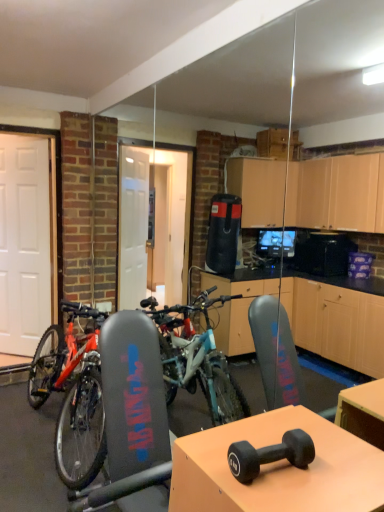
Question: In the image, is black rubber dumbbell at center on the left side or the right side of teal matte bicycle at center?

Choices:
 (A) left
 (B) right

Answer: (B)

Question: From a real-world perspective, is black rubber dumbbell at center physically located above or below teal matte bicycle at center?

Choices:
 (A) below
 (B) above

Answer: (B)

Question: Estimate the real-world distances between objects in this image. Which object is closer to the black rubber dumbbell at center?

Choices:
 (A) teal matte bicycle at center
 (B) matte black dumbbell at center
 (C) white matte door at left

Answer: (B)

Question: Which object is positioned closest to the teal matte bicycle at center?

Choices:
 (A) black rubber dumbbell at center
 (B) white matte door at left
 (C) matte black dumbbell at center

Answer: (B)